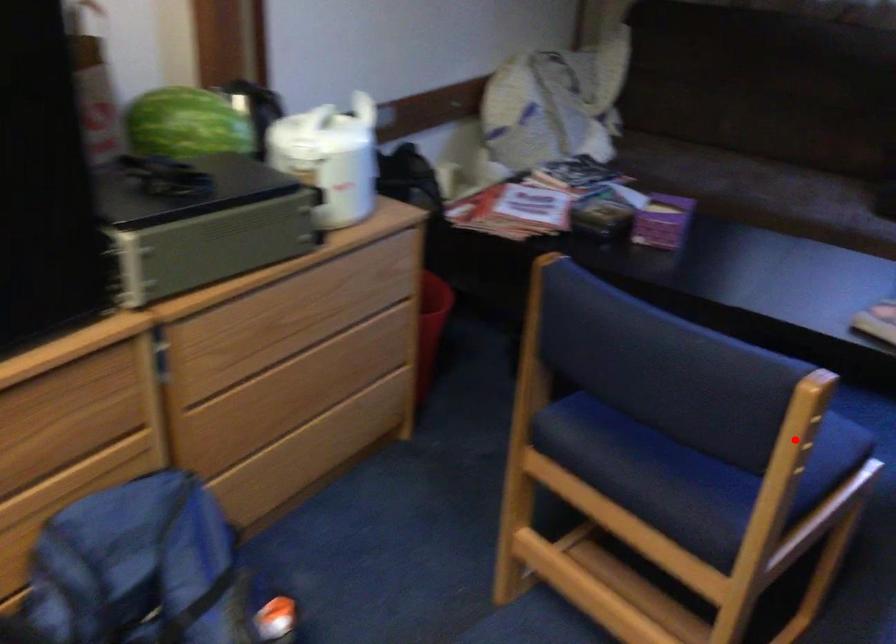
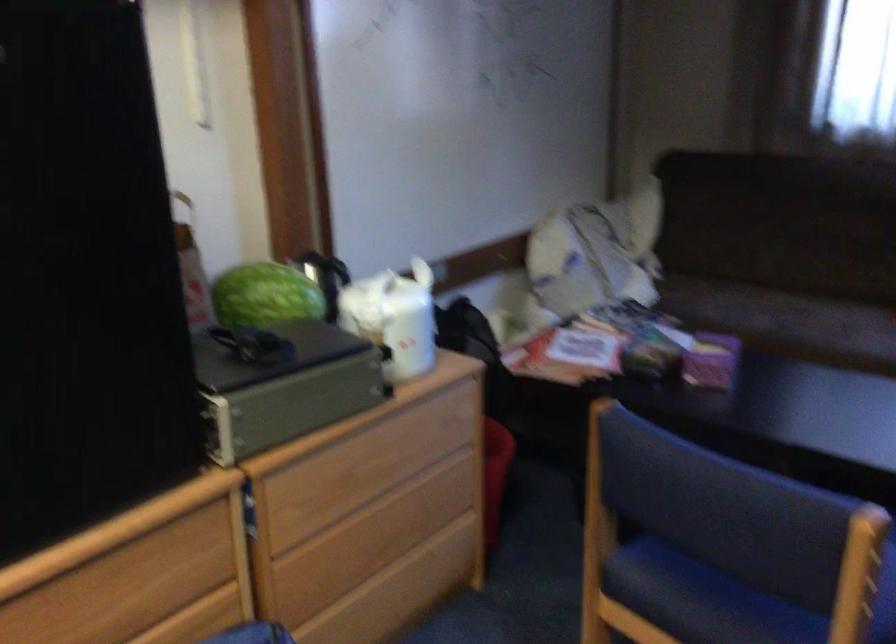
Locate, in the second image, the point that corresponds to the highlighted location in the first image.

(858, 574)